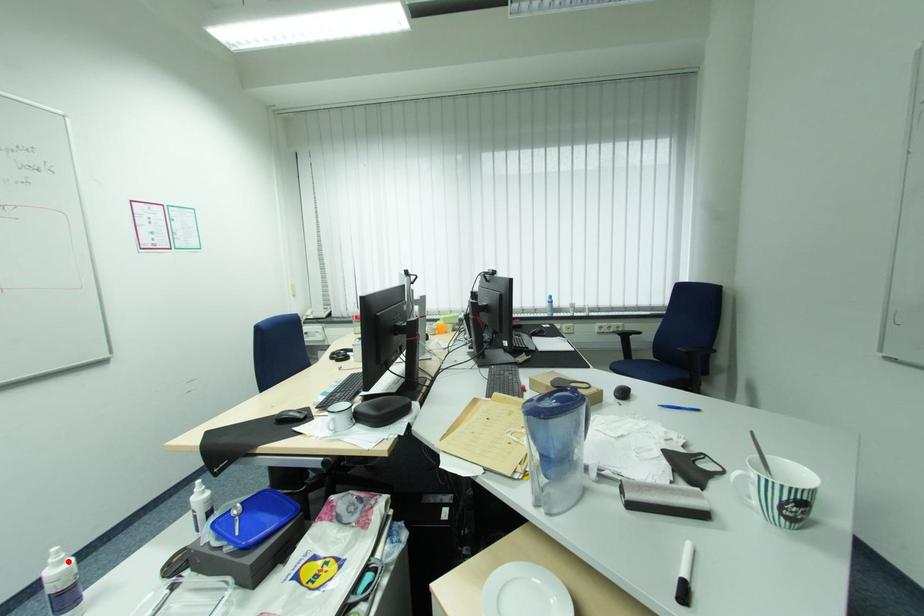
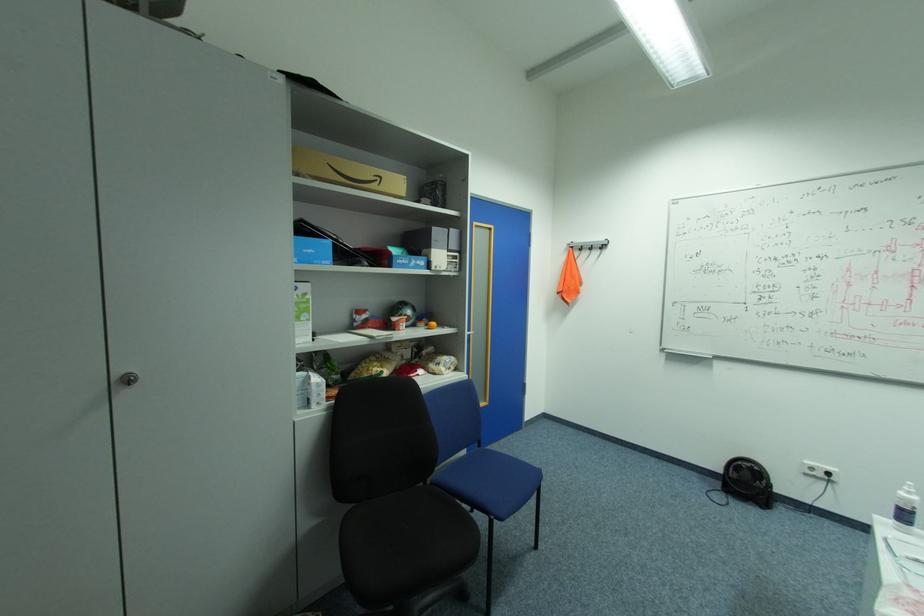
Question: I am providing you with two images of the same scene from different viewpoints. Image1 has a red point marked. In image2, the corresponding 3D location appears at what relative position? Reply with the corresponding letter.

Choices:
 (A) Closer
 (B) Farther

Answer: (B)